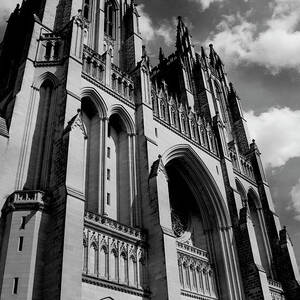
Find the location of a particular element. smaller archways is located at coordinates (88, 103), (51, 85), (117, 115), (240, 183), (252, 191).